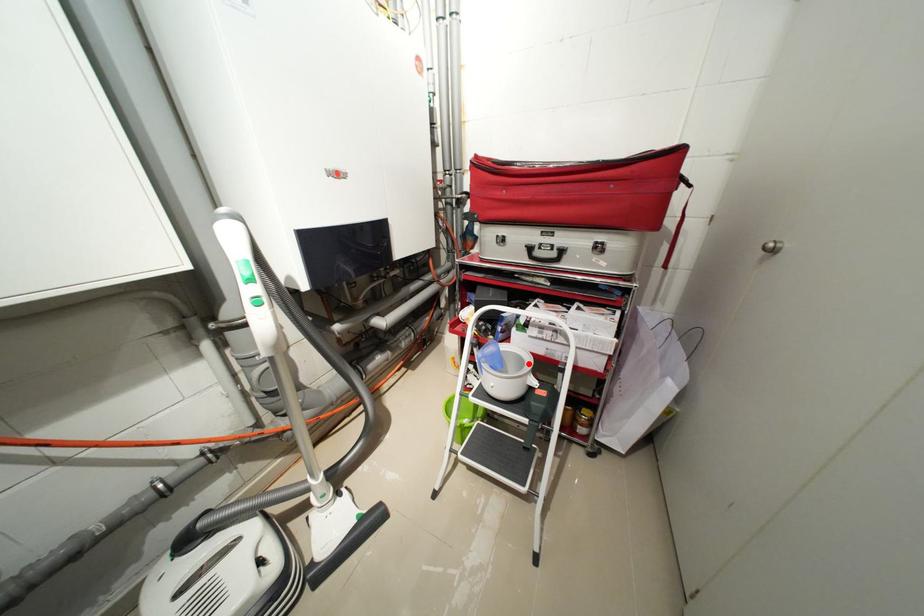
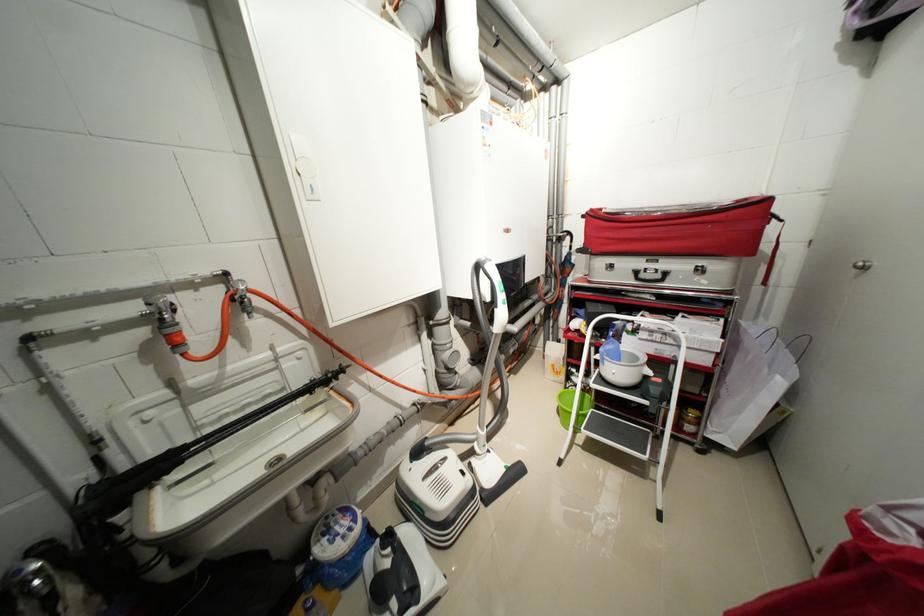
Question: I am providing you with two images of the same scene from different viewpoints. A red point is marked on the first image. At the location where the point appears in image 1, is it still visible in image 2?

Choices:
 (A) Yes
 (B) No

Answer: (A)